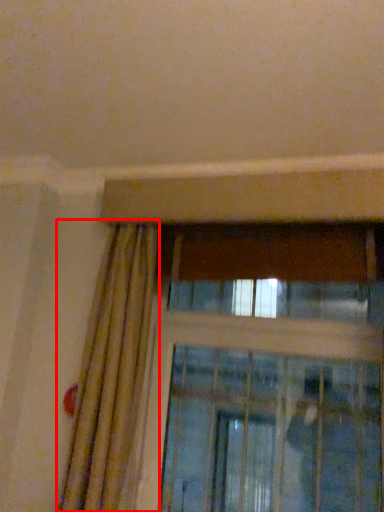
Question: From the image, what is the correct spatial relationship of curtain (annotated by the red box) in relation to screen door?

Choices:
 (A) left
 (B) right

Answer: (A)